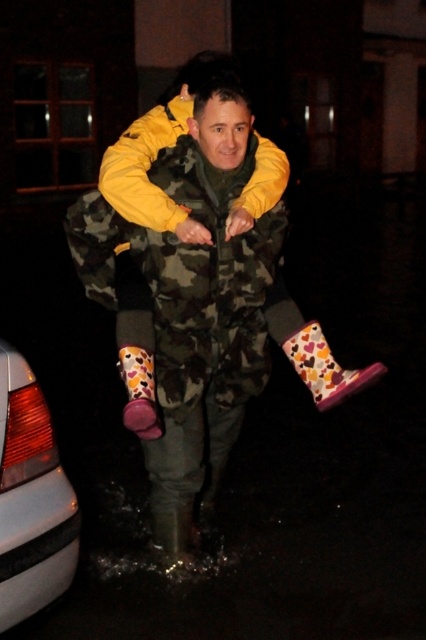
Question: Based on their relative distances, which object is farther from the multicolored rubber boot at lower center?

Choices:
 (A) floral rubber boot at lower center
 (B) white glossy car at lower left

Answer: (B)

Question: Based on their relative distances, which object is nearer to the multicolored rubber boot at lower center?

Choices:
 (A) white glossy car at lower left
 (B) floral rubber boot at lower center

Answer: (B)

Question: Is white glossy car at lower left wider than floral rubber boot at lower center?

Choices:
 (A) no
 (B) yes

Answer: (B)

Question: Considering the relative positions of multicolored rubber boot at lower center and floral rubber boot at lower center in the image provided, where is multicolored rubber boot at lower center located with respect to floral rubber boot at lower center?

Choices:
 (A) below
 (B) above

Answer: (B)

Question: Is white glossy car at lower left closer to camera compared to floral rubber boot at lower center?

Choices:
 (A) yes
 (B) no

Answer: (A)

Question: Which point appears closest to the camera in this image?

Choices:
 (A) (69, 556)
 (B) (158, 428)

Answer: (A)